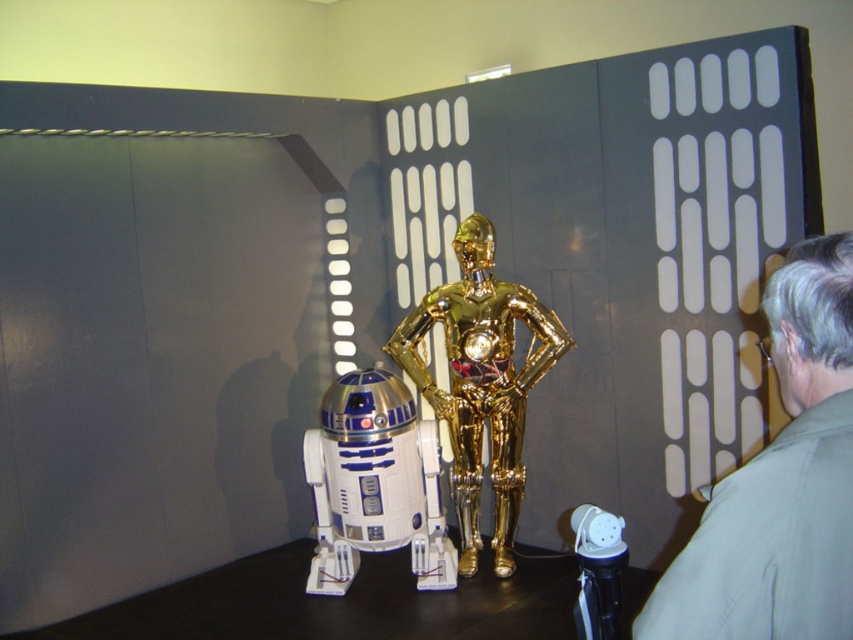
Who is lower down, gold metallic robot at center or white plastic toy at lower right?

white plastic toy at lower right

Is point (471, 301) closer to viewer compared to point (614, 557)?

That is False.

At what (x,y) coordinates should I click in order to perform the action: click on gold metallic robot at center. Please return your answer as a coordinate pair (x, y). Looking at the image, I should click on (480, 381).

Is black glossy table at lower center closer to camera compared to white plastic toy at lower right?

No.

Is black glossy table at lower center to the right of white plastic toy at lower right from the viewer's perspective?

Incorrect, black glossy table at lower center is not on the right side of white plastic toy at lower right.

Is point (386, 588) closer to camera compared to point (593, 513)?

No, it is not.

Identify the location of black glossy table at lower center. (337, 604).

Between gray fabric shirt at right and white plastic toy at lower right, which one is positioned higher?

gray fabric shirt at right is above.

Find the location of a particular element. This screenshot has height=640, width=853. gray fabric shirt at right is located at coordinates (780, 483).

Consider the image. Who is more distant from viewer, (775, 524) or (589, 620)?

Point (589, 620)

Locate an element on the screen. This screenshot has height=640, width=853. gray fabric shirt at right is located at coordinates (780, 483).